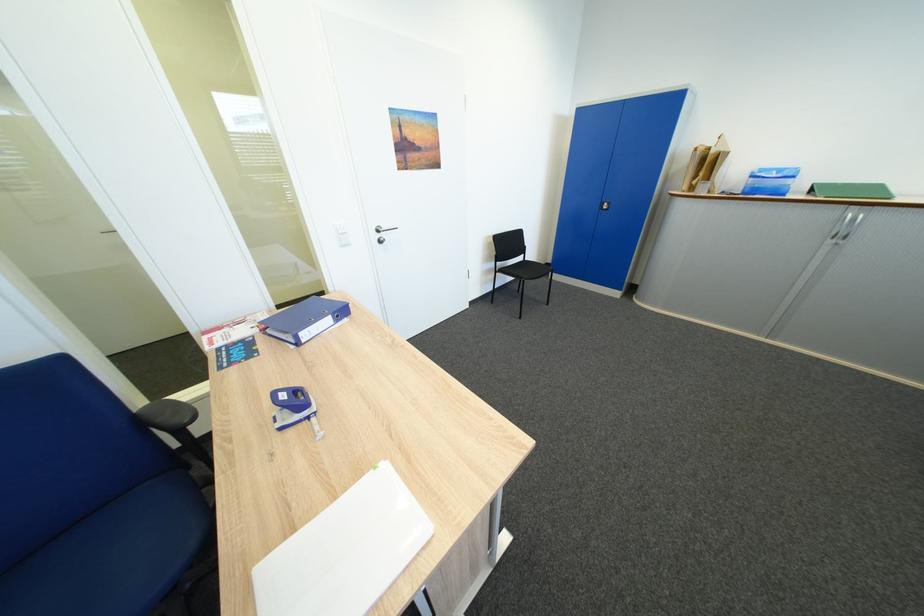
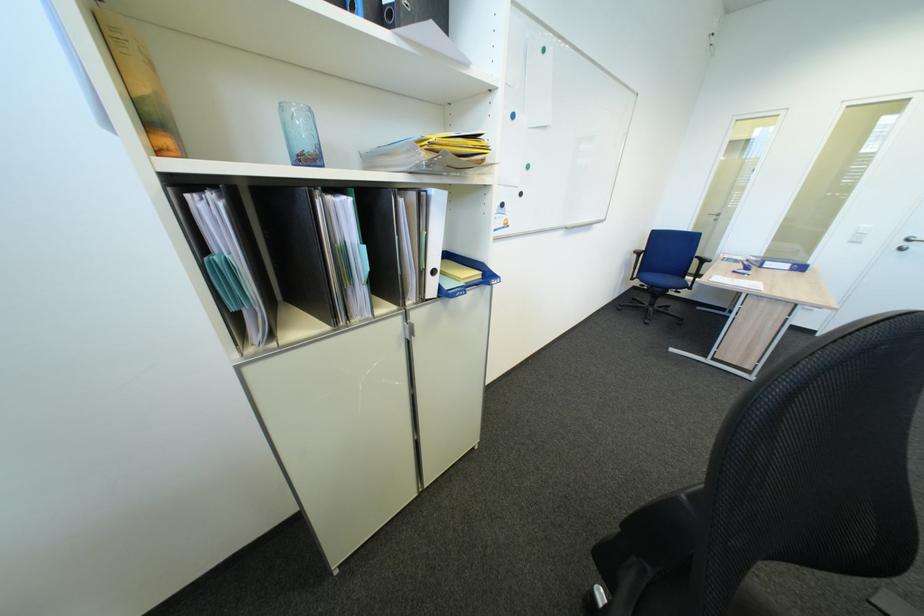
Locate, in the second image, the point that corresponds to (x=388, y=233) in the first image.

(918, 241)